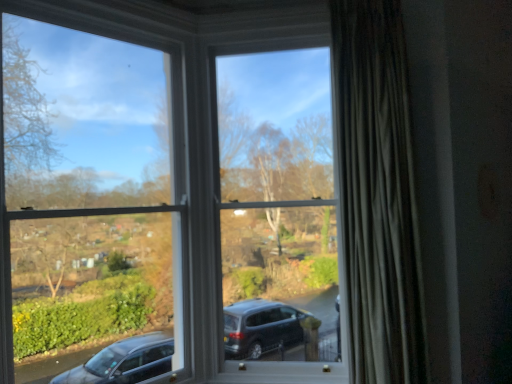
Locate an element on the screen. white plastic window frame at center, the first window frame viewed from the right is located at coordinates (277, 204).

What do you see at coordinates (377, 193) in the screenshot? Image resolution: width=512 pixels, height=384 pixels. I see `silky gray curtain at right` at bounding box center [377, 193].

The width and height of the screenshot is (512, 384). I want to click on white plastic window frame at upper left, which is counted as the first window frame, starting from the left, so click(x=86, y=204).

Locate an element on the screen. This screenshot has width=512, height=384. white plastic window frame at center, which appears as the 2th window frame when viewed from the left is located at coordinates (277, 204).

Consider the image. Is white plastic window frame at center, the first window frame viewed from the right, turned away from silky gray curtain at right?

No, white plastic window frame at center, the first window frame viewed from the right, is not facing the opposite direction of silky gray curtain at right.

From the picture: Between white plastic window frame at center, which appears as the 2th window frame when viewed from the left, and silky gray curtain at right, which one has larger size?

white plastic window frame at center, which appears as the 2th window frame when viewed from the left, is bigger.

Considering the relative positions of white plastic window frame at center, the first window frame viewed from the right, and silky gray curtain at right in the image provided, is white plastic window frame at center, the first window frame viewed from the right, to the left of silky gray curtain at right from the viewer's perspective?

Yes.

Which object is wider, white plastic window frame at center, the first window frame viewed from the right, or silky gray curtain at right?

Wider between the two is silky gray curtain at right.

Is point (21, 356) in front of point (352, 167)?

That is False.

In the scene shown: From a real-world perspective, which is physically above, white plastic window frame at upper left, which is the 2th window frame in right-to-left order, or silky gray curtain at right?

silky gray curtain at right.

Between white plastic window frame at upper left, which is counted as the first window frame, starting from the left, and silky gray curtain at right, which one has smaller width?

A: With smaller width is white plastic window frame at upper left, which is counted as the first window frame, starting from the left.

Can you confirm if white plastic window frame at upper left, which is counted as the first window frame, starting from the left, is positioned to the left of silky gray curtain at right?

Yes.

Which of these two, silky gray curtain at right or white plastic window frame at center, the first window frame viewed from the right, is wider?

With larger width is silky gray curtain at right.

From a real-world perspective, does silky gray curtain at right sit lower than white plastic window frame at center, the first window frame viewed from the right?

Actually, silky gray curtain at right is physically above white plastic window frame at center, the first window frame viewed from the right, in the real world.

Is silky gray curtain at right situated inside white plastic window frame at center, the first window frame viewed from the right, or outside?

The correct answer is: outside.

Looking at the image, does white plastic window frame at upper left, which is counted as the first window frame, starting from the left, seem bigger or smaller compared to white plastic window frame at center, which appears as the 2th window frame when viewed from the left?

white plastic window frame at upper left, which is counted as the first window frame, starting from the left, is smaller than white plastic window frame at center, which appears as the 2th window frame when viewed from the left.

Based on their positions, is white plastic window frame at upper left, which is counted as the first window frame, starting from the left, located to the left or right of white plastic window frame at center, which appears as the 2th window frame when viewed from the left?

Clearly, white plastic window frame at upper left, which is counted as the first window frame, starting from the left, is on the left of white plastic window frame at center, which appears as the 2th window frame when viewed from the left, in the image.

Is white plastic window frame at upper left, which is counted as the first window frame, starting from the left, surrounding white plastic window frame at center, the first window frame viewed from the right?

Definitely not — white plastic window frame at center, the first window frame viewed from the right, is not inside white plastic window frame at upper left, which is counted as the first window frame, starting from the left.

Is white plastic window frame at upper left, which is the 2th window frame in right-to-left order, facing away from white plastic window frame at center, which appears as the 2th window frame when viewed from the left?

No, white plastic window frame at center, which appears as the 2th window frame when viewed from the left, is not at the back of white plastic window frame at upper left, which is the 2th window frame in right-to-left order.

From a real-world perspective, between white plastic window frame at center, the first window frame viewed from the right, and white plastic window frame at upper left, which is counted as the first window frame, starting from the left, who is vertically higher?

white plastic window frame at center, the first window frame viewed from the right, is physically above.

Is white plastic window frame at upper left, which is the 2th window frame in right-to-left order, inside white plastic window frame at center, the first window frame viewed from the right?

That's incorrect, white plastic window frame at upper left, which is the 2th window frame in right-to-left order, is not inside white plastic window frame at center, the first window frame viewed from the right.

Between white plastic window frame at center, the first window frame viewed from the right, and white plastic window frame at upper left, which is counted as the first window frame, starting from the left, which one has smaller size?

With smaller size is white plastic window frame at upper left, which is counted as the first window frame, starting from the left.

From the picture: From the image's perspective, between silky gray curtain at right and white plastic window frame at upper left, which is the 2th window frame in right-to-left order, who is located below?

white plastic window frame at upper left, which is the 2th window frame in right-to-left order, appears lower in the image.

Looking at their sizes, would you say silky gray curtain at right is wider or thinner than white plastic window frame at upper left, which is counted as the first window frame, starting from the left?

Considering their sizes, silky gray curtain at right looks broader than white plastic window frame at upper left, which is counted as the first window frame, starting from the left.

Are silky gray curtain at right and white plastic window frame at upper left, which is the 2th window frame in right-to-left order, making contact?

There is a gap between silky gray curtain at right and white plastic window frame at upper left, which is the 2th window frame in right-to-left order.

Would you say silky gray curtain at right is to the left or to the right of white plastic window frame at upper left, which is the 2th window frame in right-to-left order, in the picture?

Based on their positions, silky gray curtain at right is located to the right of white plastic window frame at upper left, which is the 2th window frame in right-to-left order.

This screenshot has height=384, width=512. Find the location of `window frame that is the 1st object directly below the silky gray curtain at right (from a real-world perspective)`. window frame that is the 1st object directly below the silky gray curtain at right (from a real-world perspective) is located at coordinates (277, 204).

I want to click on the 2nd window frame to the left of the silky gray curtain at right, counting from the anchor's position, so click(x=86, y=204).

From the image, which object appears to be farther from silky gray curtain at right, white plastic window frame at center, the first window frame viewed from the right, or white plastic window frame at upper left, which is the 2th window frame in right-to-left order?

Among the two, white plastic window frame at upper left, which is the 2th window frame in right-to-left order, is located further to silky gray curtain at right.

Looking at this image, based on their spatial positions, is silky gray curtain at right or white plastic window frame at center, which appears as the 2th window frame when viewed from the left, further from white plastic window frame at upper left, which is counted as the first window frame, starting from the left?

silky gray curtain at right is positioned further to the anchor white plastic window frame at upper left, which is counted as the first window frame, starting from the left.

Based on their spatial positions, is white plastic window frame at center, which appears as the 2th window frame when viewed from the left, or silky gray curtain at right further from white plastic window frame at upper left, which is counted as the first window frame, starting from the left?

silky gray curtain at right is positioned further to the anchor white plastic window frame at upper left, which is counted as the first window frame, starting from the left.

Estimate the real-world distances between objects in this image. Which object is further from white plastic window frame at center, which appears as the 2th window frame when viewed from the left, silky gray curtain at right or white plastic window frame at upper left, which is the 2th window frame in right-to-left order?

white plastic window frame at upper left, which is the 2th window frame in right-to-left order, lies further to white plastic window frame at center, which appears as the 2th window frame when viewed from the left, than the other object.

Estimate the real-world distances between objects in this image. Which object is closer to white plastic window frame at center, the first window frame viewed from the right, white plastic window frame at upper left, which is counted as the first window frame, starting from the left, or silky gray curtain at right?

Based on the image, silky gray curtain at right appears to be nearer to white plastic window frame at center, the first window frame viewed from the right.

From the image, which object appears to be nearer to silky gray curtain at right, white plastic window frame at upper left, which is the 2th window frame in right-to-left order, or white plastic window frame at center, which appears as the 2th window frame when viewed from the left?

white plastic window frame at center, which appears as the 2th window frame when viewed from the left, lies closer to silky gray curtain at right than the other object.

Image resolution: width=512 pixels, height=384 pixels. I want to click on window frame situated between white plastic window frame at upper left, which is counted as the first window frame, starting from the left, and silky gray curtain at right from left to right, so click(277, 204).